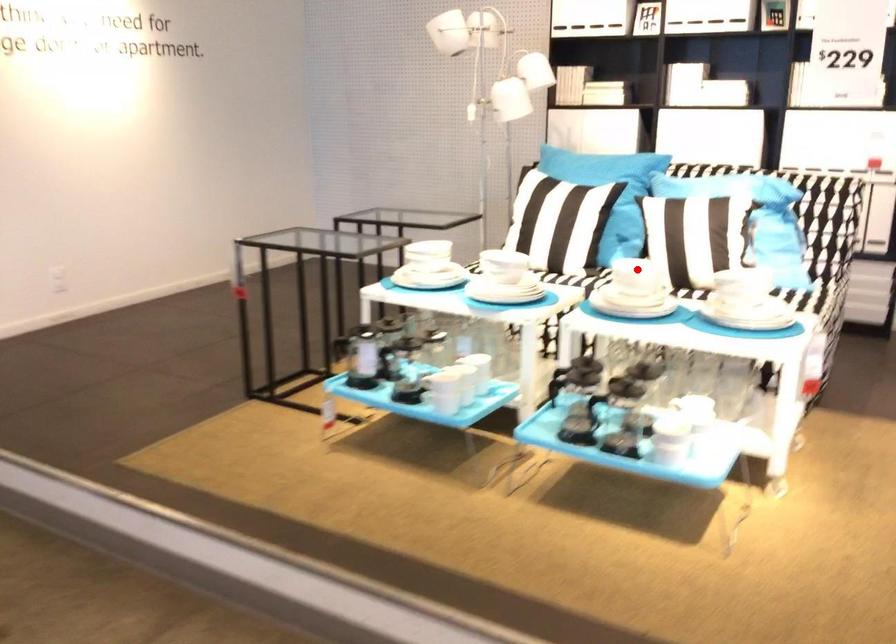
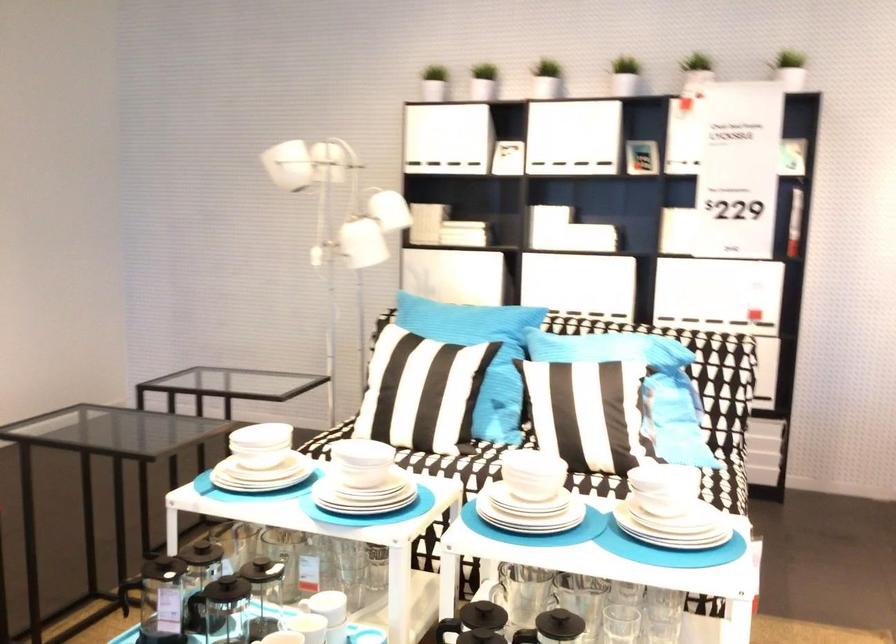
Question: I am providing you with two images of the same scene from different viewpoints. Given a red point in image1, look at the same physical point in image2. Is it:

Choices:
 (A) Closer to the viewpoint
 (B) Farther from the viewpoint

Answer: (A)